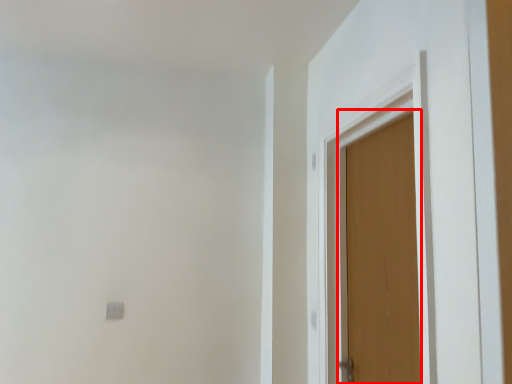
Question: From the image's perspective, what is the correct spatial positioning of door (annotated by the red box) in reference to door?

Choices:
 (A) below
 (B) above

Answer: (A)